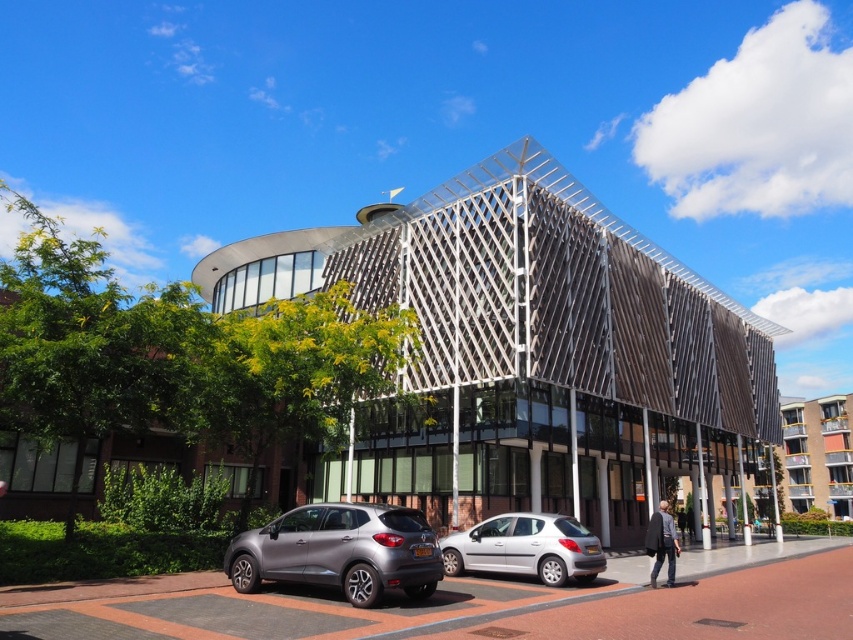
Between point (548, 477) and point (795, 481), which one is positioned behind?

Point (795, 481)

Image resolution: width=853 pixels, height=640 pixels. What do you see at coordinates (529, 348) in the screenshot? I see `wooden lattice structure at center` at bounding box center [529, 348].

Is point (556, 452) closer to camera compared to point (795, 484)?

Yes, point (556, 452) is closer to viewer.

Identify the location of wooden lattice structure at center. This screenshot has width=853, height=640. (529, 348).

Between silver metallic hatchback at center and gray concrete building at center, which one has more height?

Standing taller between the two is gray concrete building at center.

The height and width of the screenshot is (640, 853). Describe the element at coordinates (525, 547) in the screenshot. I see `silver metallic hatchback at center` at that location.

Is point (576, 557) more distant than point (830, 461)?

No, (576, 557) is in front of (830, 461).

This screenshot has width=853, height=640. I want to click on silver metallic hatchback at center, so click(525, 547).

Between wooden lattice structure at center and dark gray sweater at lower right, which one is positioned lower?

dark gray sweater at lower right is lower down.

Is wooden lattice structure at center closer to the viewer compared to dark gray sweater at lower right?

No, it is behind dark gray sweater at lower right.

Does point (576, 406) come farther from viewer compared to point (666, 525)?

Yes, it is.

Locate an element on the screen. Image resolution: width=853 pixels, height=640 pixels. wooden lattice structure at center is located at coordinates (529, 348).